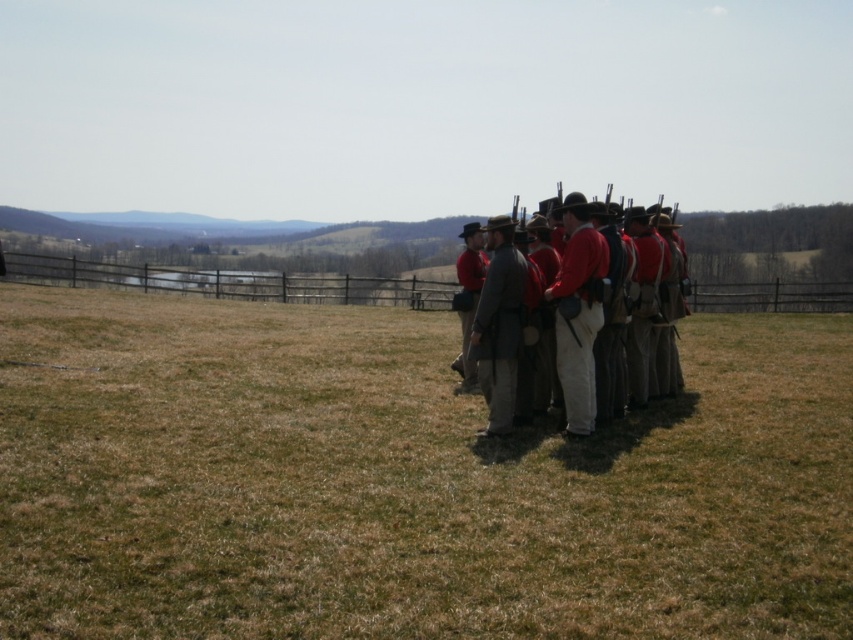
Between brown dry grass at center and matte red coat at center, which one appears on the left side from the viewer's perspective?

Positioned to the left is matte red coat at center.

Does brown dry grass at center have a lesser height compared to matte red coat at center?

Correct, brown dry grass at center is not as tall as matte red coat at center.

Does point (236, 467) come behind point (583, 298)?

That is False.

Image resolution: width=853 pixels, height=640 pixels. I want to click on brown dry grass at center, so click(404, 481).

Can you confirm if brown dry grass at center is shorter than red woolen coat at center?

Yes.

Is brown dry grass at center to the left of red woolen coat at center from the viewer's perspective?

No, brown dry grass at center is not to the left of red woolen coat at center.

Does point (294, 332) lie in front of point (582, 332)?

No, (294, 332) is further to viewer.

Image resolution: width=853 pixels, height=640 pixels. I want to click on brown dry grass at center, so click(404, 481).

Can you confirm if matte red coat at center is smaller than gray wool coat at center?

Incorrect, matte red coat at center is not smaller in size than gray wool coat at center.

Does point (602, 244) come closer to viewer compared to point (476, 307)?

Yes, point (602, 244) is closer to viewer.

What do you see at coordinates (578, 312) in the screenshot? Image resolution: width=853 pixels, height=640 pixels. I see `matte red coat at center` at bounding box center [578, 312].

You are a GUI agent. You are given a task and a screenshot of the screen. Output one action in this format:
    pyautogui.click(x=<x>, y=<y>)
    Task: Click on the matte red coat at center
    Image resolution: width=853 pixels, height=640 pixels.
    Given the screenshot: What is the action you would take?
    pyautogui.click(x=578, y=312)